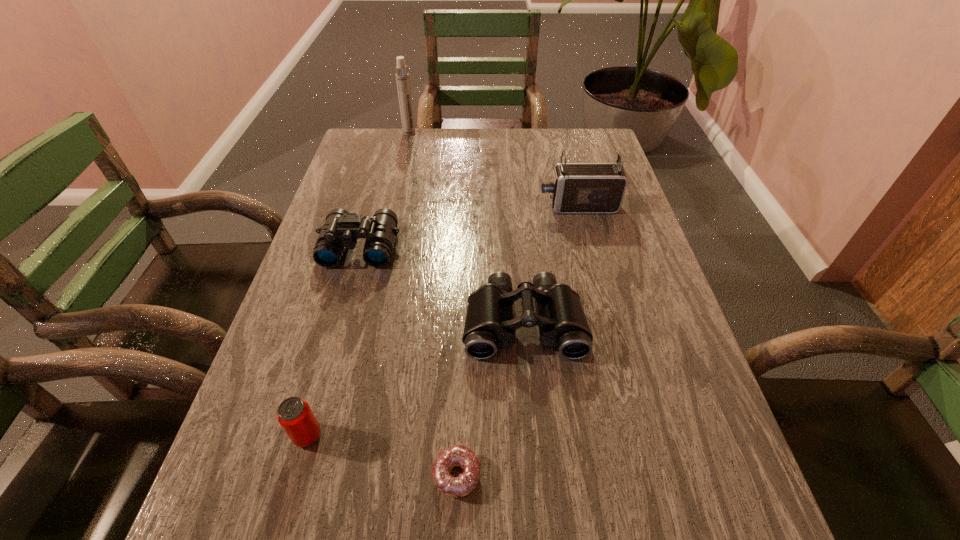
You are a GUI agent. You are given a task and a screenshot of the screen. Output one action in this format:
    pyautogui.click(x=<x>, y=<y>)
    Task: Click on the shortest object
    Image resolution: width=960 pixels, height=540 pixels.
    Given the screenshot: What is the action you would take?
    pyautogui.click(x=456, y=455)

At what (x,y) coordinates should I click in order to perform the action: click on free region located 0.080m on the right of the farthest object. Please return your answer as a coordinate pair (x, y). The image size is (960, 540). Looking at the image, I should click on 438,133.

This screenshot has width=960, height=540. In order to click on vacant area situated at the lens of the camcorder in this screenshot , I will do `click(486, 206)`.

Identify the location of vacant area situated at the lens of the camcorder. Image resolution: width=960 pixels, height=540 pixels. (475, 206).

Where is `vacant space positioned at the lens of the camcorder`? vacant space positioned at the lens of the camcorder is located at coordinates (496, 206).

Locate an element on the screen. free region located through the lenses of the fourth nearest object is located at coordinates (346, 300).

This screenshot has height=540, width=960. Identify the location of vacant space positioned 0.320m on the front-facing side of the nearer binoculars. [542, 538].

Where is `vacant space located on the right of the second nearest object`? This screenshot has height=540, width=960. vacant space located on the right of the second nearest object is located at coordinates (372, 435).

The width and height of the screenshot is (960, 540). Identify the location of free space located on the left of the nearest object. (331, 475).

The image size is (960, 540). I want to click on object that is at the far edge, so click(402, 77).